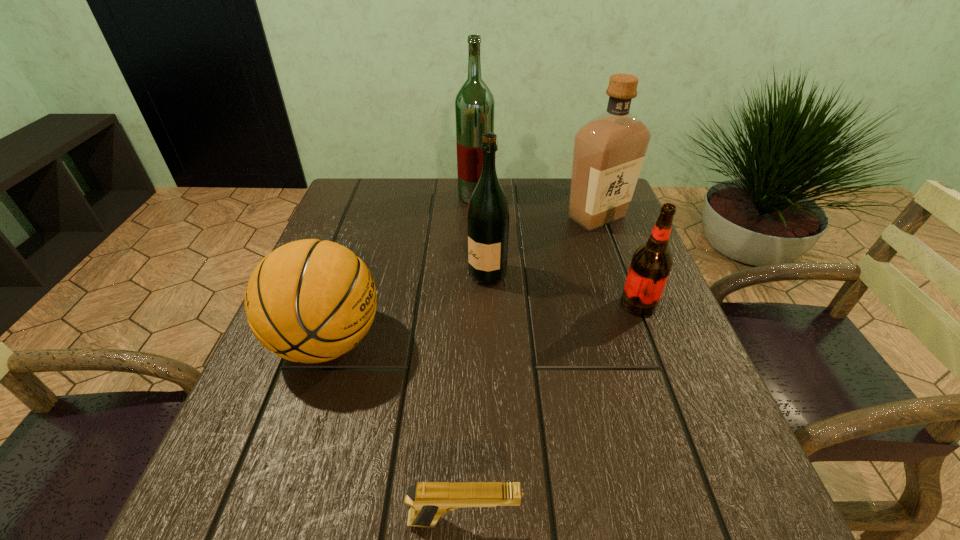
Locate an element on the screen. This screenshot has height=540, width=960. the rightmost liquor is located at coordinates (609, 150).

At what (x,y) coordinates should I click in order to perform the action: click on the fourth nearest object. Please return your answer as a coordinate pair (x, y). This screenshot has width=960, height=540. Looking at the image, I should click on (488, 214).

This screenshot has width=960, height=540. I want to click on root beer, so click(651, 263).

At what (x,y) coordinates should I click in order to perform the action: click on the leftmost object. Please return your answer as a coordinate pair (x, y). The image size is (960, 540). Looking at the image, I should click on (310, 301).

Locate an element on the screen. Image resolution: width=960 pixels, height=540 pixels. the shortest object is located at coordinates (428, 500).

At what (x,y) coordinates should I click in order to perform the action: click on the nearest object. Please return your answer as a coordinate pair (x, y). Looking at the image, I should click on (428, 500).

Where is `vacant area situated on the front-facing side of the rightmost liquor`? This screenshot has height=540, width=960. vacant area situated on the front-facing side of the rightmost liquor is located at coordinates (627, 299).

At what (x,y) coordinates should I click in order to perform the action: click on vacant area situated 0.320m on the front-facing side of the third farthest object. Please return your answer as a coordinate pair (x, y). This screenshot has height=540, width=960. Looking at the image, I should click on (324, 275).

Identify the location of vacant region located 0.070m on the front-facing side of the third farthest object. click(x=437, y=275).

Where is `free space located 0.210m on the front-facing side of the third farthest object`? free space located 0.210m on the front-facing side of the third farthest object is located at coordinates (373, 275).